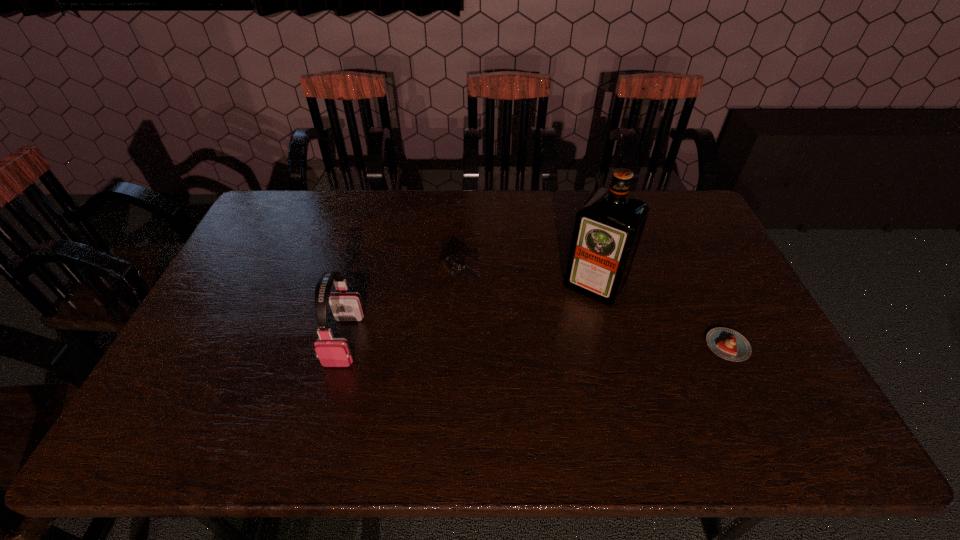
The width and height of the screenshot is (960, 540). Find the location of `vacant space situated 0.340m at the barrel of the pistol`. vacant space situated 0.340m at the barrel of the pistol is located at coordinates (573, 357).

Identify the location of free space located at the barrel of the pistol. The width and height of the screenshot is (960, 540). (499, 310).

In order to click on vacant space located on the front label of the liquor in this screenshot , I will do `click(549, 352)`.

The image size is (960, 540). In order to click on vacant space positioned 0.380m on the front label of the liquor in this screenshot , I will do `click(515, 403)`.

You are a GUI agent. You are given a task and a screenshot of the screen. Output one action in this format:
    pyautogui.click(x=<x>, y=<y>)
    Task: Click on the vacant region located on the front label of the liquor
    This screenshot has width=960, height=540.
    Given the screenshot: What is the action you would take?
    pyautogui.click(x=574, y=315)

At what (x,y) coordinates should I click in order to perform the action: click on object that is at the right edge. Please return your answer as a coordinate pair (x, y). The image size is (960, 540). Looking at the image, I should click on (728, 344).

Locate an element on the screen. vacant region at the far edge of the desktop is located at coordinates (506, 224).

In order to click on free space at the near edge of the desktop in this screenshot , I will do `click(308, 399)`.

The image size is (960, 540). I want to click on vacant space at the right edge of the desktop, so click(703, 281).

I want to click on vacant space at the far left corner of the desktop, so click(301, 191).